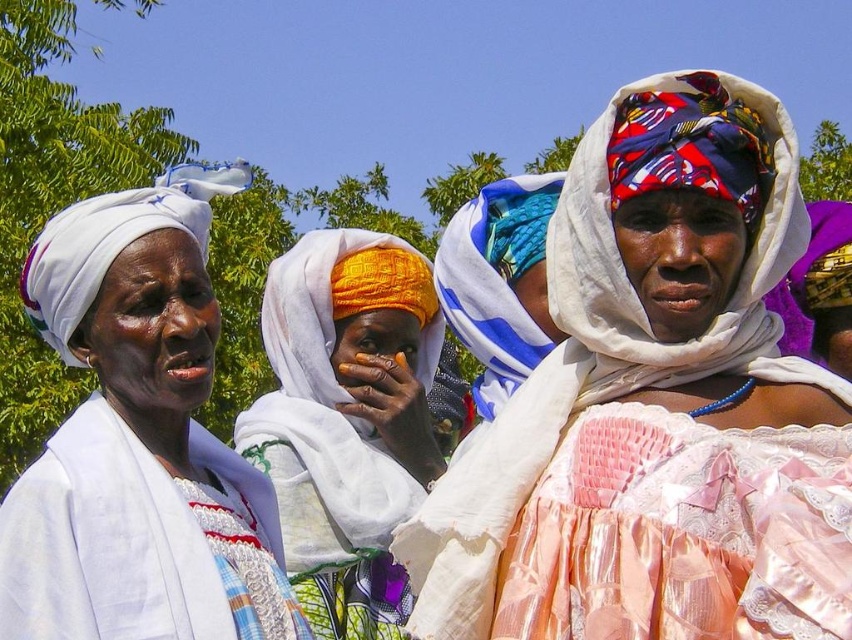
You are a photographer trying to capture the scene. You want to ensure the white woven cloth at left and the matte yellow fabric headscarf at center are both in frame. Based on their positions, which object should you focus on first to ensure both are visible?

The white woven cloth at left is to the left of the matte yellow fabric headscarf at center, so you should focus on the matte yellow fabric headscarf at center first to ensure both are visible.

You are a photographer trying to capture the shiny silk dress at center. You need to adjust your camera to focus on the point with coordinates (655, 406). What object should you focus on?

The point with coordinates (655, 406) corresponds to the shiny silk dress at center, so you should focus on the shiny silk dress at center.